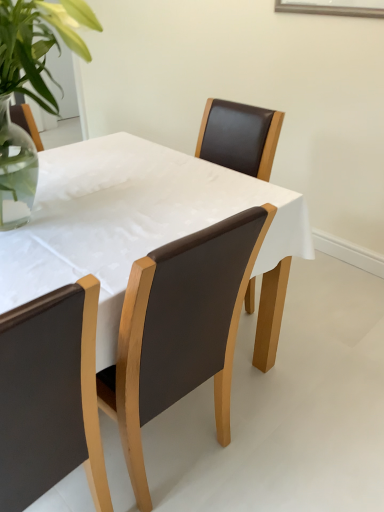
Question: Is matte black chair at lower left, the 2th chair when ordered from right to left, far from brown leather chair at center, acting as the 1th chair starting from the right?

Choices:
 (A) no
 (B) yes

Answer: (A)

Question: Can you confirm if matte black chair at lower left, arranged as the first chair when viewed from the left, is wider than brown leather chair at center, acting as the 1th chair starting from the right?

Choices:
 (A) no
 (B) yes

Answer: (A)

Question: Can you confirm if matte black chair at lower left, arranged as the first chair when viewed from the left, is positioned to the left of brown leather chair at center, acting as the 1th chair starting from the right?

Choices:
 (A) yes
 (B) no

Answer: (A)

Question: Can you confirm if matte black chair at lower left, the 2th chair when ordered from right to left, is shorter than brown leather chair at center, the 2th chair in the left-to-right sequence?

Choices:
 (A) yes
 (B) no

Answer: (B)

Question: Does matte black chair at lower left, arranged as the first chair when viewed from the left, touch brown leather chair at center, the 2th chair in the left-to-right sequence?

Choices:
 (A) yes
 (B) no

Answer: (B)

Question: Considering their positions, is matte brown table at center located in front of or behind matte black chair at lower left, arranged as the first chair when viewed from the left?

Choices:
 (A) behind
 (B) front

Answer: (A)

Question: Is matte brown table at center spatially inside matte black chair at lower left, arranged as the first chair when viewed from the left, or outside of it?

Choices:
 (A) inside
 (B) outside

Answer: (B)

Question: Is point (193, 187) positioned closer to the camera than point (102, 483)?

Choices:
 (A) farther
 (B) closer

Answer: (A)

Question: From a real-world perspective, is matte brown table at center positioned above or below matte black chair at lower left, arranged as the first chair when viewed from the left?

Choices:
 (A) below
 (B) above

Answer: (A)

Question: From the image's perspective, is matte black chair at lower left, arranged as the first chair when viewed from the left, located above or below brown leather chair at center, acting as the 1th chair starting from the right?

Choices:
 (A) below
 (B) above

Answer: (A)

Question: Is matte black chair at lower left, the 2th chair when ordered from right to left, spatially inside brown leather chair at center, acting as the 1th chair starting from the right, or outside of it?

Choices:
 (A) outside
 (B) inside

Answer: (A)

Question: Relative to brown leather chair at center, the 2th chair in the left-to-right sequence, is matte black chair at lower left, the 2th chair when ordered from right to left, in front or behind?

Choices:
 (A) front
 (B) behind

Answer: (A)

Question: Is matte black chair at lower left, the 2th chair when ordered from right to left, wider or thinner than brown leather chair at center, acting as the 1th chair starting from the right?

Choices:
 (A) thin
 (B) wide

Answer: (A)

Question: Is brown leather chair at center, acting as the 1th chair starting from the right, to the left or to the right of matte black chair at lower left, arranged as the first chair when viewed from the left, in the image?

Choices:
 (A) left
 (B) right

Answer: (B)

Question: From the image's perspective, is brown leather chair at center, the 2th chair in the left-to-right sequence, above or below matte black chair at lower left, the 2th chair when ordered from right to left?

Choices:
 (A) below
 (B) above

Answer: (B)